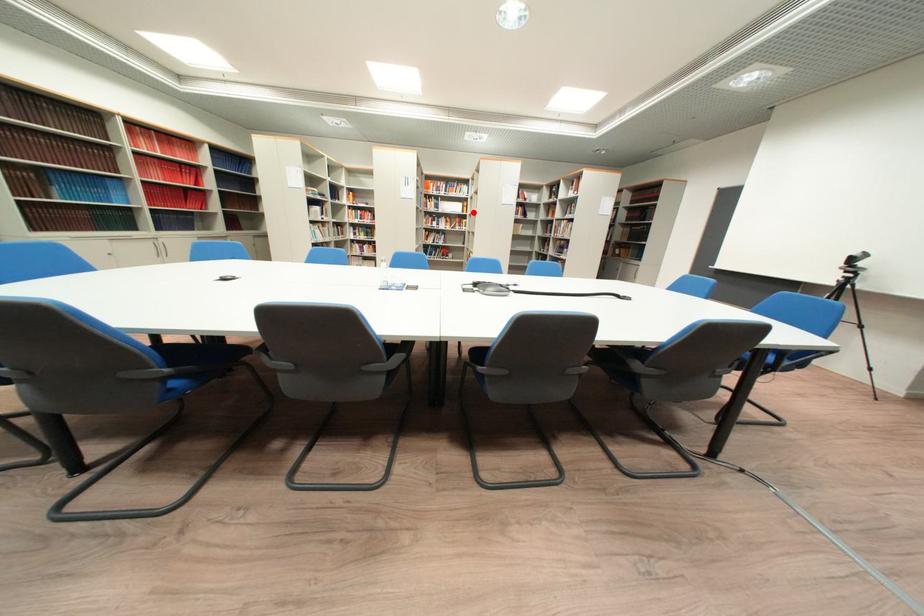
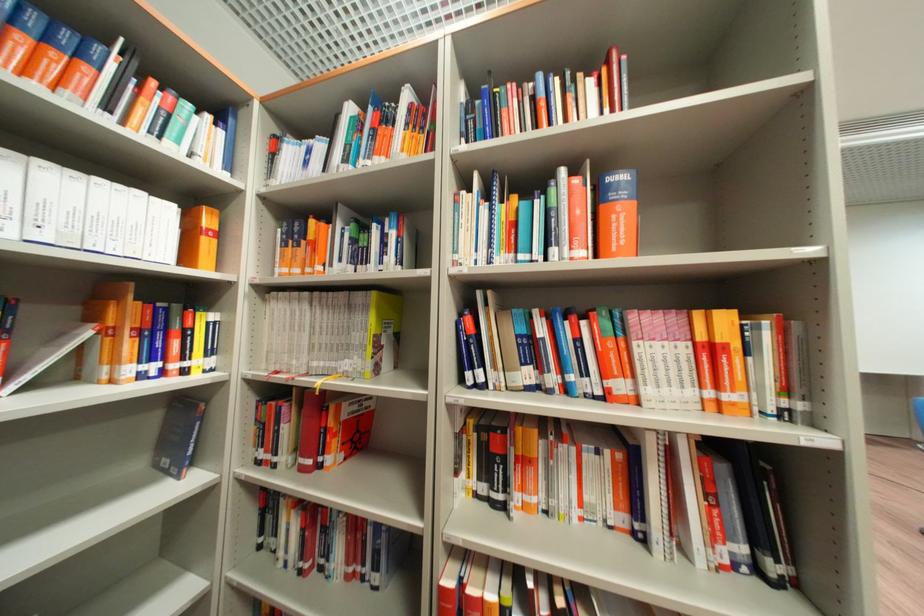
Question: A red point is marked in image1. In image2, is the corresponding 3D point closer to the camera or farther? Reply with the corresponding letter.

Choices:
 (A) The corresponding 3D point is closer.
 (B) The corresponding 3D point is farther.

Answer: (B)